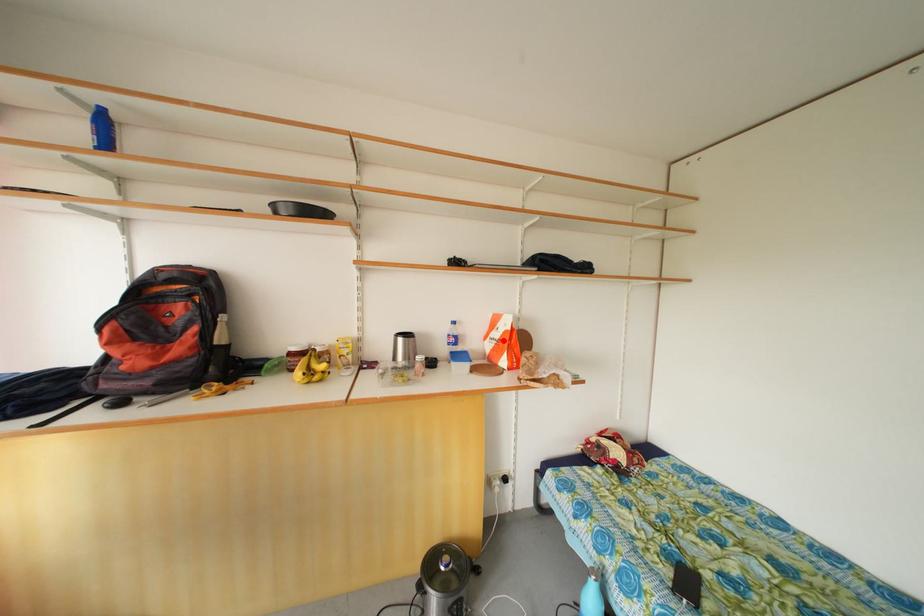
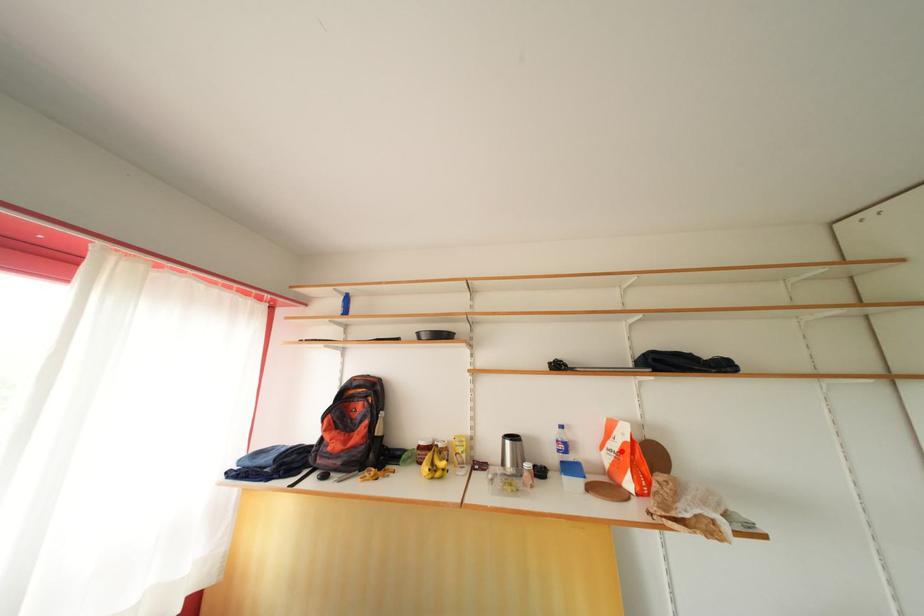
I am providing you with two images of the same scene from different viewpoints. A red point is marked on the first image and another point is marked on the second image. Does the point marked in image1 correspond to the same location as the one in image2?

Yes